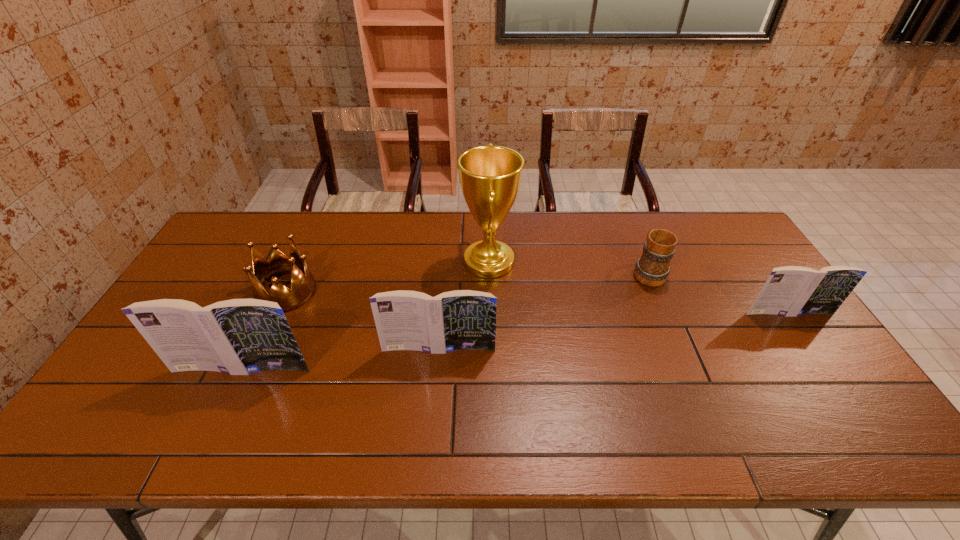
If we want them evenly spaced by inserting an extra book among them, please locate a free spot for this new book. Please provide its 2D coordinates. Your answer should be formatted as a tuple, i.e. [(x, y)], where the tuple contains the x and y coordinates of a point satisfying the conditions above.

[(620, 330)]